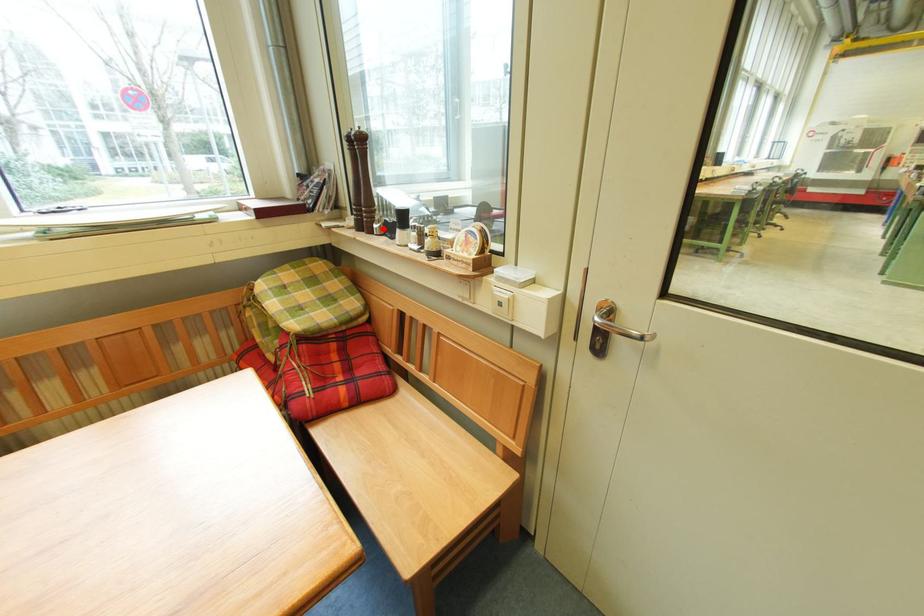
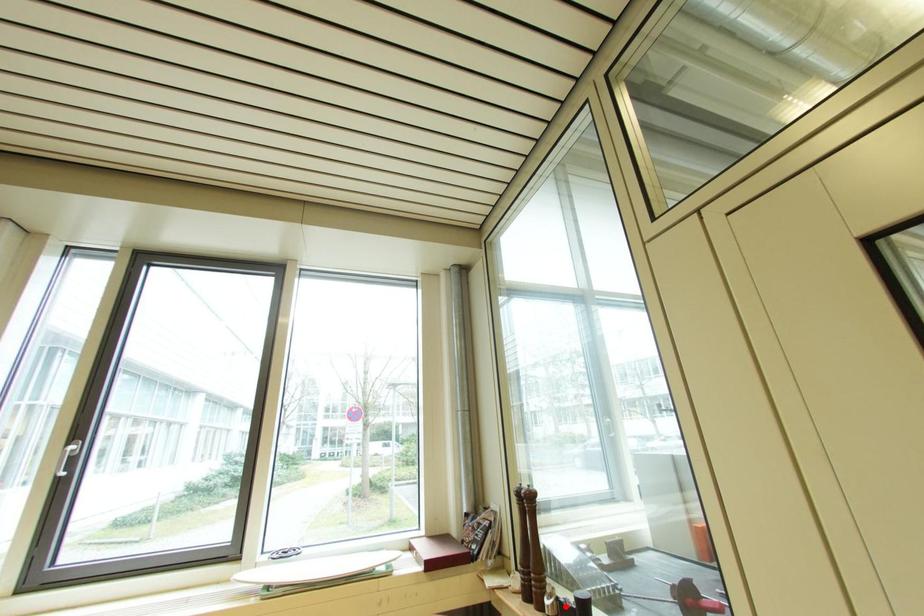
I am providing you with two images of the same scene from different viewpoints. A red point is marked on the first image and another point is marked on the second image. Are the points marked in image1 and image2 representing the same 3D position?

No